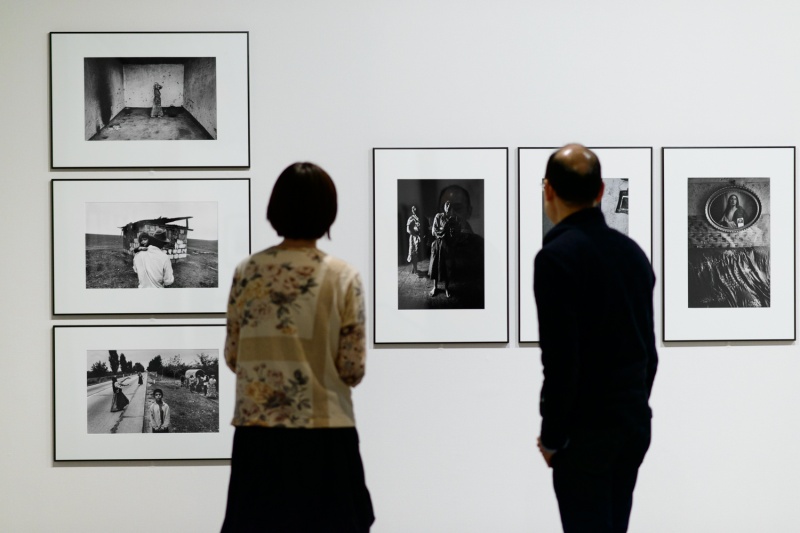
I want to click on frame, so click(x=784, y=146), click(x=754, y=340), click(x=444, y=342), click(x=124, y=313).